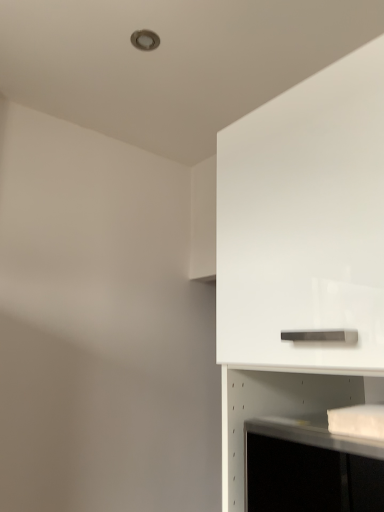
Question: Is white glossy shelf at lower right to the right of white glossy cabinet at upper right from the viewer's perspective?

Choices:
 (A) yes
 (B) no

Answer: (B)

Question: Is the depth of white glossy shelf at lower right greater than that of white glossy cabinet at upper right?

Choices:
 (A) yes
 (B) no

Answer: (A)

Question: Is white glossy shelf at lower right far away from white glossy cabinet at upper right?

Choices:
 (A) no
 (B) yes

Answer: (A)

Question: Can you confirm if white glossy shelf at lower right is smaller than white glossy cabinet at upper right?

Choices:
 (A) no
 (B) yes

Answer: (B)

Question: Could you tell me if white glossy shelf at lower right is facing white glossy cabinet at upper right?

Choices:
 (A) no
 (B) yes

Answer: (B)

Question: Considering the relative sizes of white glossy shelf at lower right and white glossy cabinet at upper right in the image provided, is white glossy shelf at lower right wider than white glossy cabinet at upper right?

Choices:
 (A) yes
 (B) no

Answer: (B)

Question: Is white glossy shelf at lower right inside white glossy cabinet at upper right?

Choices:
 (A) yes
 (B) no

Answer: (A)

Question: Does white glossy cabinet at upper right have a lesser width compared to white glossy shelf at lower right?

Choices:
 (A) no
 (B) yes

Answer: (A)

Question: Can you confirm if white glossy cabinet at upper right is smaller than white glossy shelf at lower right?

Choices:
 (A) yes
 (B) no

Answer: (B)

Question: Does white glossy cabinet at upper right touch white glossy shelf at lower right?

Choices:
 (A) yes
 (B) no

Answer: (B)

Question: Is white glossy cabinet at upper right positioned before white glossy shelf at lower right?

Choices:
 (A) yes
 (B) no

Answer: (A)

Question: Is white glossy cabinet at upper right wider than white glossy shelf at lower right?

Choices:
 (A) no
 (B) yes

Answer: (B)

Question: Considering the positions of white glossy shelf at lower right and white glossy cabinet at upper right in the image, is white glossy shelf at lower right taller or shorter than white glossy cabinet at upper right?

Choices:
 (A) short
 (B) tall

Answer: (A)